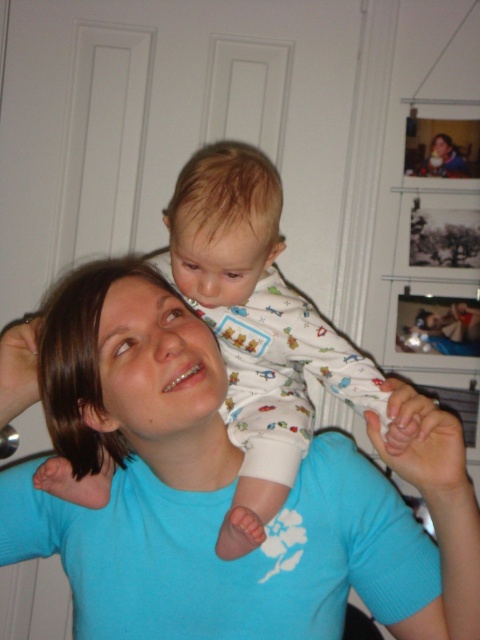
Question: Does blue cotton shirt at center have a greater width compared to white cotton onesie at center?

Choices:
 (A) yes
 (B) no

Answer: (A)

Question: Can you confirm if blue cotton shirt at center is bigger than white cotton onesie at center?

Choices:
 (A) no
 (B) yes

Answer: (A)

Question: Can you confirm if blue cotton shirt at center is positioned to the right of white cotton onesie at center?

Choices:
 (A) yes
 (B) no

Answer: (B)

Question: Which object is closer to the camera taking this photo?

Choices:
 (A) blue cotton shirt at center
 (B) white cotton onesie at center

Answer: (A)

Question: Which point is farther to the camera?

Choices:
 (A) (259, 234)
 (B) (78, 563)

Answer: (A)